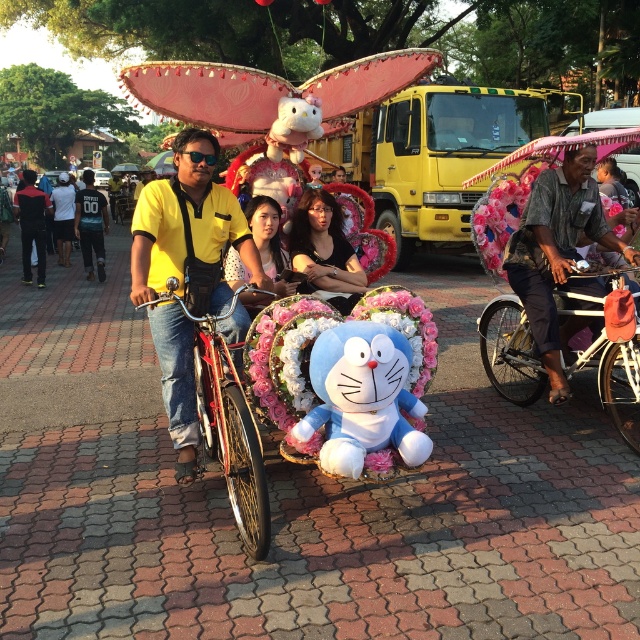
Question: Among these points, which one is farthest from the camera?

Choices:
 (A) (269, 234)
 (B) (324, 198)
 (C) (49, 205)
 (D) (68, 196)

Answer: (D)

Question: Is black cotton shirt at left above white cotton shirt at center?

Choices:
 (A) no
 (B) yes

Answer: (A)

Question: Among these points, which one is nearest to the camera?

Choices:
 (A) (554, 205)
 (B) (392, 368)
 (C) (506, 356)

Answer: (B)

Question: Can you confirm if metallic silver bicycle at center is positioned below white cotton shirt at center?

Choices:
 (A) yes
 (B) no

Answer: (A)

Question: Among these objects, which one is nearest to the camera?

Choices:
 (A) blue plush toy at center
 (B) dark gray striped shirt at center
 (C) black cotton shirt at left
 (D) metallic red bicycle at center

Answer: (D)

Question: Is dark gray striped shirt at center further to camera compared to metallic silver bicycle at center?

Choices:
 (A) no
 (B) yes

Answer: (B)